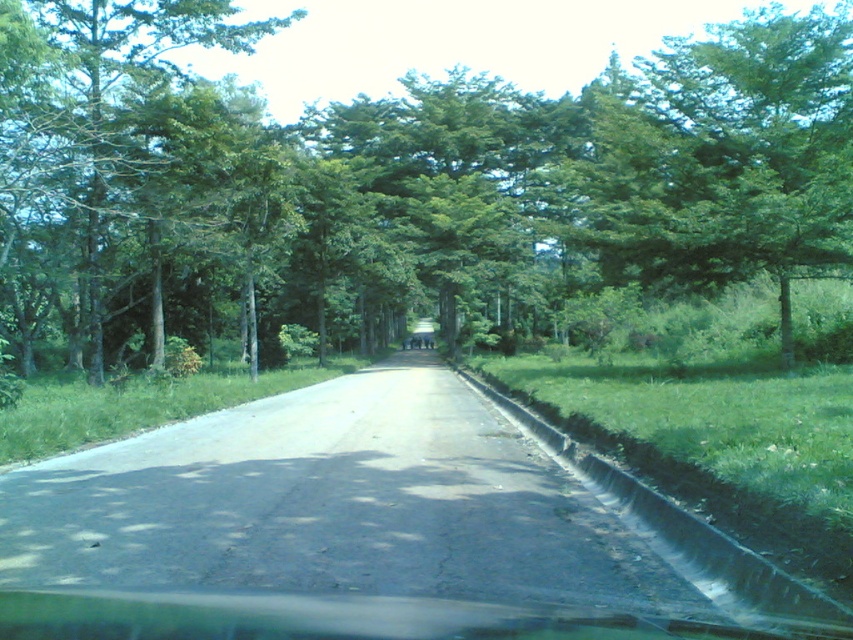
Question: Is green leafy tree at center thinner than green leafy tree at left?

Choices:
 (A) no
 (B) yes

Answer: (A)

Question: Considering the real-world distances, which object is closest to the green leafy tree at upper right?

Choices:
 (A) green leafy tree at left
 (B) green leafy tree at center

Answer: (B)

Question: Does green leafy tree at center appear on the left side of green leafy tree at left?

Choices:
 (A) no
 (B) yes

Answer: (A)

Question: Can you confirm if green leafy tree at upper right is positioned below green leafy tree at left?

Choices:
 (A) no
 (B) yes

Answer: (A)

Question: Which of the following is the closest to the observer?

Choices:
 (A) (468, 138)
 (B) (97, 136)

Answer: (B)

Question: Which point appears farthest from the camera in this image?

Choices:
 (A) (85, 56)
 (B) (283, 19)

Answer: (B)